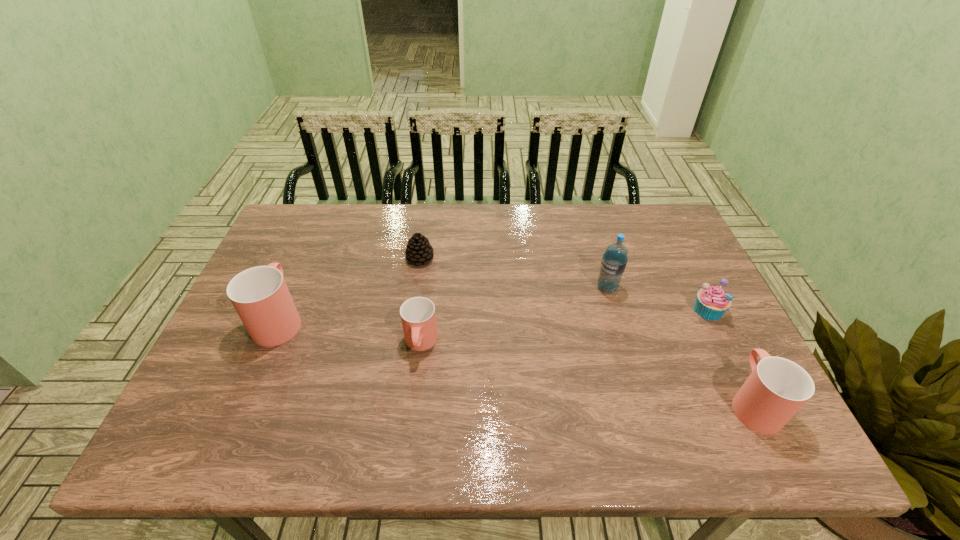
Identify the location of free space between the pinecone and the second shortest cup. (587, 330).

Find the location of `free point between the shortest cup and the muffin`. free point between the shortest cup and the muffin is located at coordinates (564, 327).

I want to click on unoccupied position between the muffin and the shortest cup, so click(564, 327).

Image resolution: width=960 pixels, height=540 pixels. I want to click on vacant point located between the leftmost cup and the rightmost cup, so click(x=516, y=361).

The height and width of the screenshot is (540, 960). I want to click on vacant space that's between the leftmost object and the water bottle, so coord(444,303).

Where is `empty location between the muffin and the farthest object`? empty location between the muffin and the farthest object is located at coordinates (564, 284).

You are a GUI agent. You are given a task and a screenshot of the screen. Output one action in this format:
    pyautogui.click(x=<x>, y=<y>)
    Task: Click on the free space between the second tallest cup and the pinecone
    Image resolution: width=960 pixels, height=540 pixels.
    Given the screenshot: What is the action you would take?
    (587, 330)

I want to click on unoccupied area between the fourth shortest object and the second tallest object, so click(516, 361).

Where is `the third closest object relative to the pinecone`? The height and width of the screenshot is (540, 960). the third closest object relative to the pinecone is located at coordinates (614, 260).

This screenshot has height=540, width=960. Identify the location of object that is the fifth closest to the leftmost object. (711, 303).